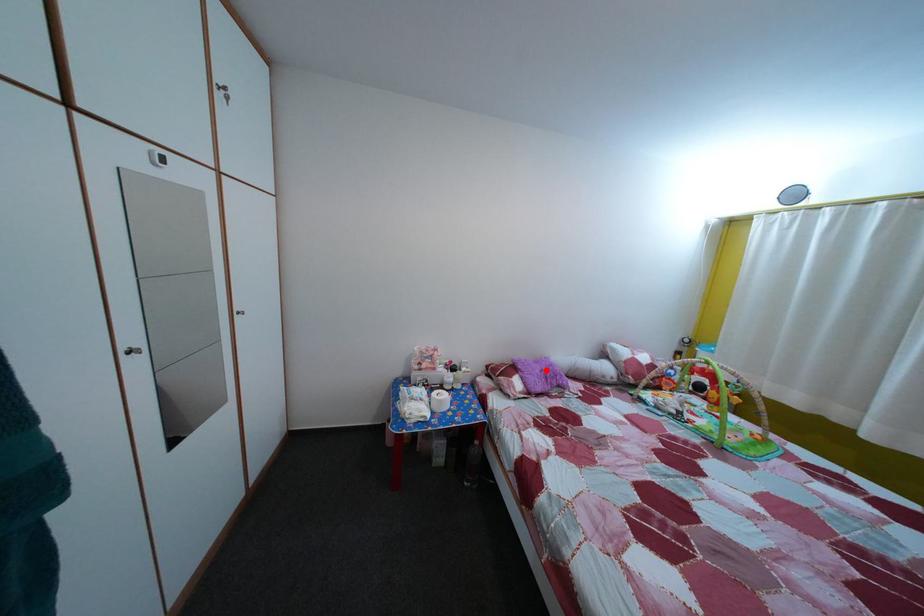
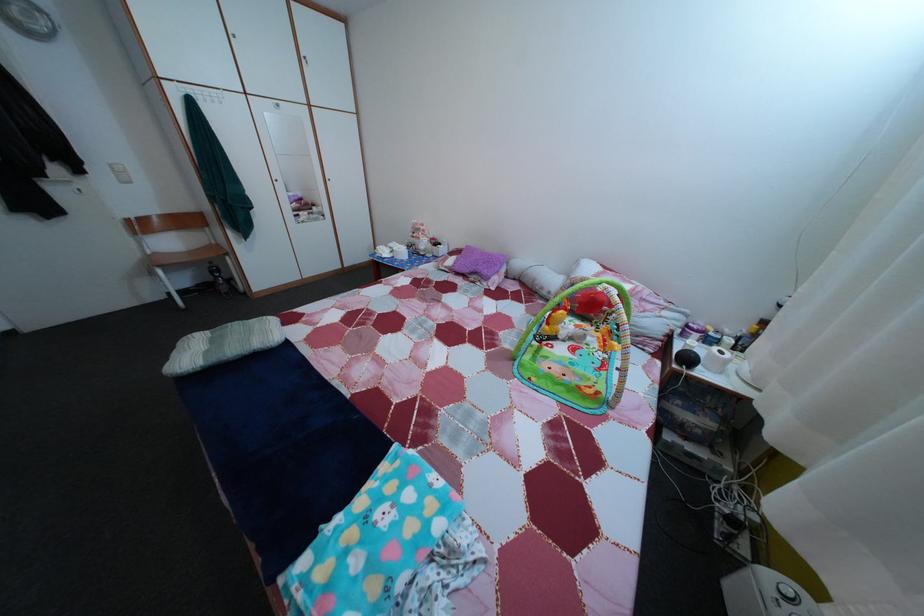
Question: I am providing you with two images of the same scene from different viewpoints. Given a red point in image1, look at the same physical point in image2. Is it:

Choices:
 (A) Closer to the viewpoint
 (B) Farther from the viewpoint

Answer: (A)